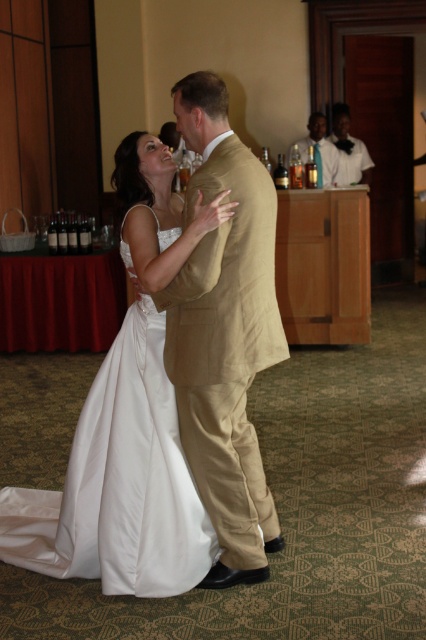
Based on the photo, you are standing at the entrance of the wedding reception and want to take a photo of the dancing couple. You notice two points marked in the image. The first point is at coordinate point (164, 353) and the second is at point (345, 172). Which point is closer to you, the photographer, so you can frame the shot better?

Point (164, 353) is closer to the viewer than point (345, 172), so you should frame the shot using the closer point to ensure the couple is centered properly.